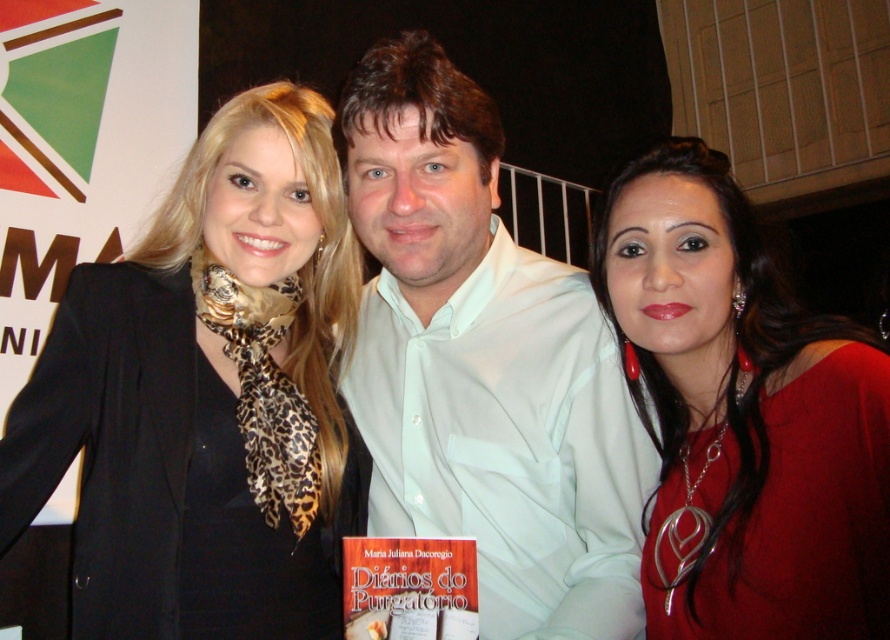
Question: Which point is farther from the camera taking this photo?

Choices:
 (A) click(637, 380)
 (B) click(551, 273)
 (C) click(233, 289)

Answer: (B)

Question: Can you confirm if black leopard print scarf at center is positioned above matte red blouse at center?

Choices:
 (A) yes
 (B) no

Answer: (A)

Question: Estimate the real-world distances between objects in this image. Which object is closer to the black leopard print scarf at center?

Choices:
 (A) matte red blouse at center
 (B) white cotton shirt at center

Answer: (B)

Question: Considering the relative positions of white cotton shirt at center and matte red blouse at center in the image provided, where is white cotton shirt at center located with respect to matte red blouse at center?

Choices:
 (A) below
 (B) above

Answer: (B)

Question: Which point is farther to the camera?

Choices:
 (A) matte red blouse at center
 (B) black leopard print scarf at center
 (C) white cotton shirt at center

Answer: (B)

Question: Is white cotton shirt at center wider than matte red blouse at center?

Choices:
 (A) yes
 (B) no

Answer: (A)